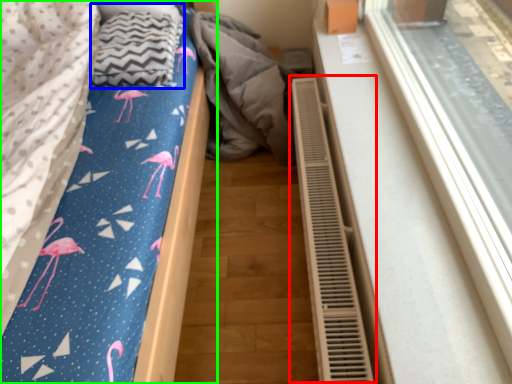
Question: Which object is positioned closest to air conditioner (highlighted by a red box)? Select from blanket (highlighted by a blue box) and bed (highlighted by a green box).

Choices:
 (A) blanket
 (B) bed

Answer: (B)